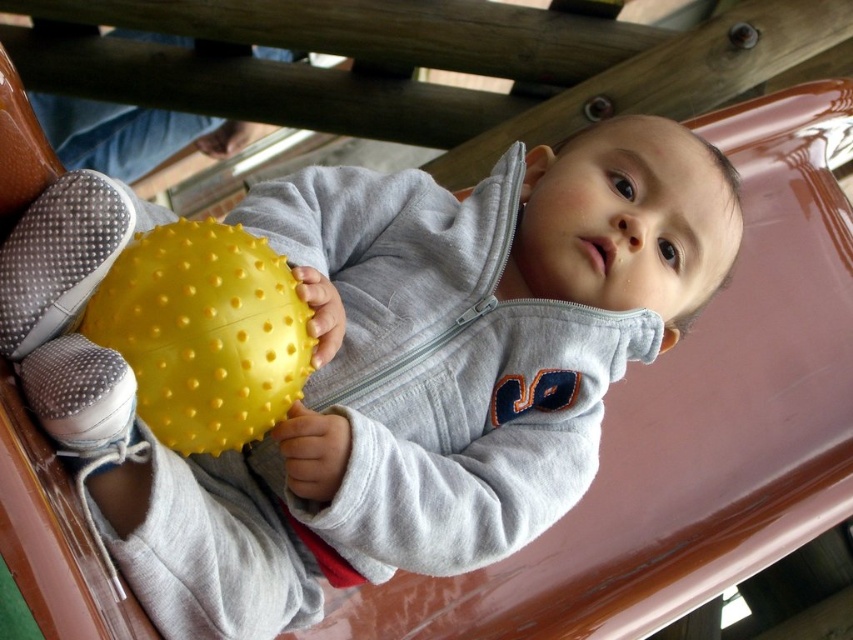
You are a parent standing next to your child who is holding the matte yellow ball at center. You want to hand them a snack from your bag that is 12 inches away from you. Can you reach the snack without moving your position?

The matte yellow ball at center and viewer are 29.91 inches apart. Since the snack is only 12 inches away from you, you can easily reach it without moving your position.

What object is located at the coordinates point (381, 365) in the image?

The point (381, 365) corresponds to the matte yellow ball at center.

You are a parent trying to retrieve a ball for your child. You see two balls at the center of the image. Which one is closer to you, the matte yellow ball at center or the yellow rubber ball at center?

The matte yellow ball at center is closer to you because it is in front of the yellow rubber ball at center.